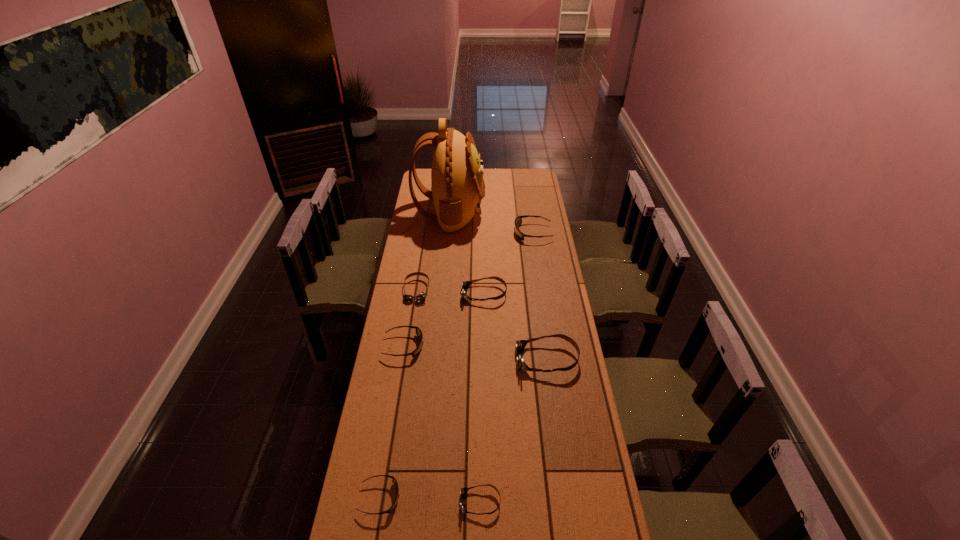
This screenshot has width=960, height=540. Identify the location of backpack. (458, 187).

Locate an element on the screen. beige backpack is located at coordinates (458, 187).

Find the location of a particular element. the seventh shortest object is located at coordinates (519, 345).

Where is `the rightmost brown goggles`? the rightmost brown goggles is located at coordinates (519, 345).

This screenshot has width=960, height=540. I want to click on the rightmost black goggles, so click(x=518, y=221).

The height and width of the screenshot is (540, 960). What are the coordinates of `the farthest black goggles` in the screenshot? It's located at (518, 221).

This screenshot has width=960, height=540. Find the location of `the third smallest brown goggles`. the third smallest brown goggles is located at coordinates 465,285.

The width and height of the screenshot is (960, 540). I want to click on the second nearest black goggles, so click(418, 332).

What are the coordinates of `the leftmost brown goggles` in the screenshot? It's located at (420, 297).

Identify the location of the smallest black goggles. (394, 480).